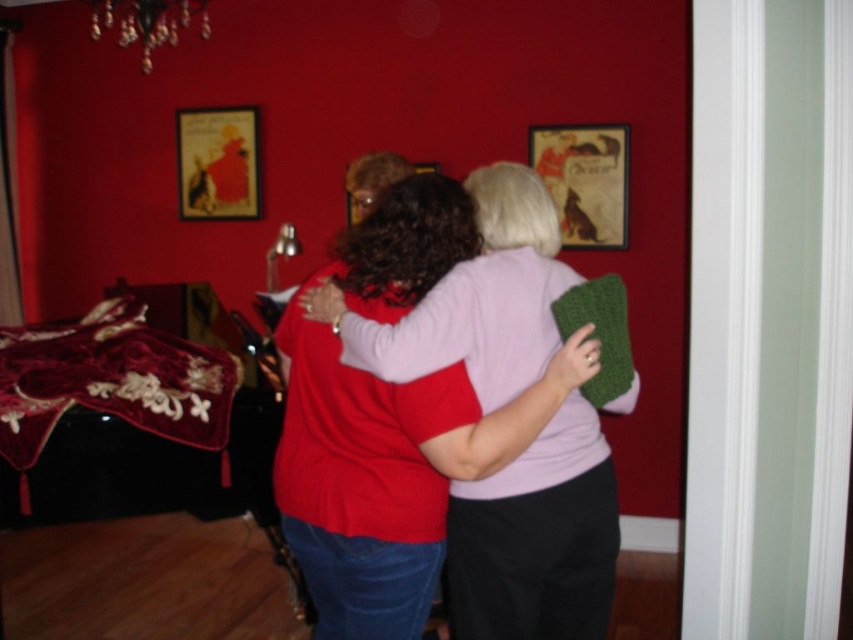
Does matte pink sweater at center appear on the right side of metallic gold picture frame at center?

Indeed, matte pink sweater at center is positioned on the right side of metallic gold picture frame at center.

Is point (469, 273) farther from viewer compared to point (352, 211)?

No, it is in front of (352, 211).

Identify the location of matte pink sweater at center. This screenshot has height=640, width=853. (537, 538).

Is point (550, 125) in front of point (425, 166)?

That is True.

You are a GUI agent. You are given a task and a screenshot of the screen. Output one action in this format:
    pyautogui.click(x=<x>, y=<y>)
    Task: Click on the metallic gold picture frame at upper center
    
    Given the screenshot: What is the action you would take?
    pyautogui.click(x=585, y=180)

Does point (253, 122) come closer to viewer compared to point (351, 205)?

No, it is behind (351, 205).

Is matte black picture frame at upper center bigger than metallic gold picture frame at center?

Correct, matte black picture frame at upper center is larger in size than metallic gold picture frame at center.

Who is more distant from viewer, (189,156) or (351,214)?

Positioned behind is point (189,156).

Locate an element on the screen. The width and height of the screenshot is (853, 640). matte black picture frame at upper center is located at coordinates (218, 163).